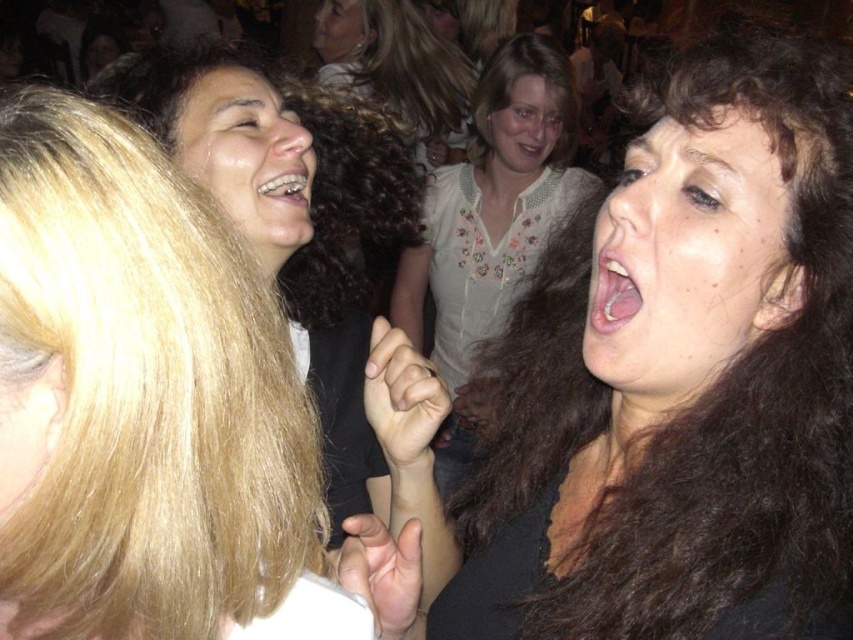
Question: Which object is positioned closest to the dark brown hair at center?

Choices:
 (A) smooth skin face at upper center
 (B) smooth white blouse at center
 (C) metallic braces at mouth right
 (D) smooth skin face at center

Answer: (D)

Question: Which of the following is the closest to the observer?

Choices:
 (A) blonde hair at left
 (B) dark brown hair at center

Answer: (A)

Question: Which object is farther from the camera taking this photo?

Choices:
 (A) matte white teeth at center
 (B) smooth white blouse at center

Answer: (A)

Question: Observing the image, what is the correct spatial positioning of blonde hair at left in reference to smooth skin face at upper center?

Choices:
 (A) above
 (B) below

Answer: (B)

Question: Is white floral blouse at center positioned in front of matte white teeth at center?

Choices:
 (A) yes
 (B) no

Answer: (A)

Question: Does matte black face at upper left come behind smooth skin face at upper center?

Choices:
 (A) no
 (B) yes

Answer: (A)